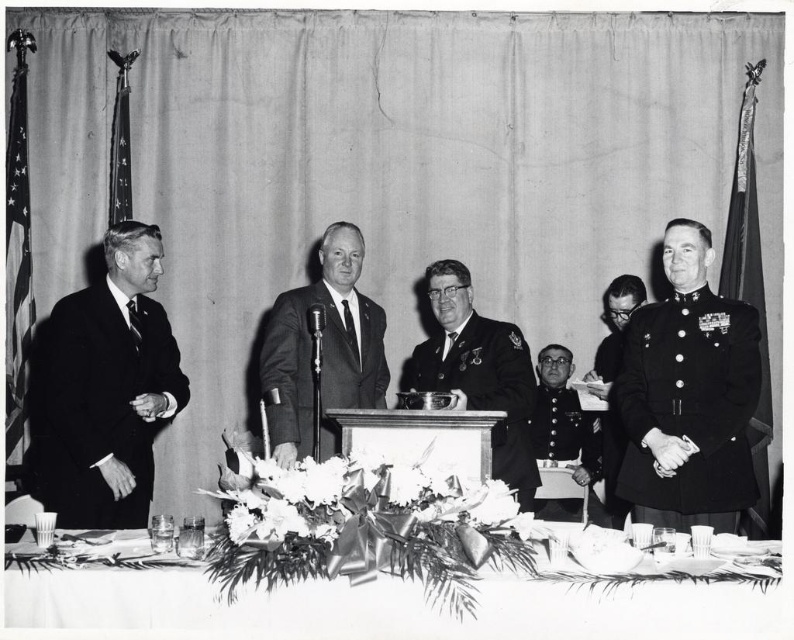
Based on the scene description, where is the uniformed officer at center located in terms of coordinates?

The uniformed officer at center is located at coordinates point [478,372].

You are a photographer standing behind the table with the floral arrangement. You need to capture a group photo of the uniformed officer at center and the uniformed military officer at right. Given that your camera has a 30 inch focal length, can you frame both officers in the same shot without moving the camera?

The uniformed officer at center and uniformed military officer at right are 36.38 inches apart from each other. Since the camera has a 30 inch focal length, which is shorter than the distance between them, you cannot frame both officers in the same shot without moving the camera.